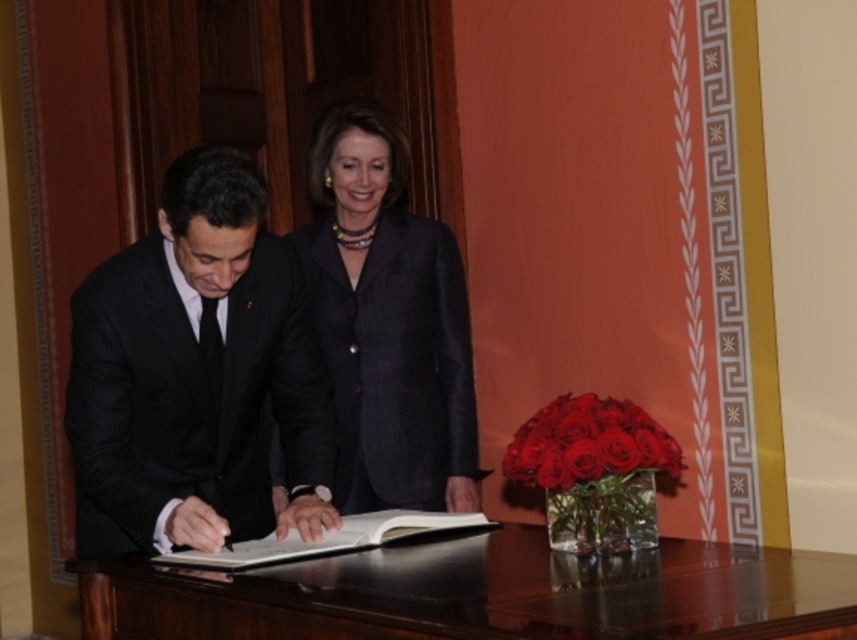
Question: Is black suit at center thinner than white paper at center?

Choices:
 (A) yes
 (B) no

Answer: (A)

Question: Which of these objects is positioned farthest from the matte black suit at center?

Choices:
 (A) shiny red roses at lower right
 (B) black suit at center
 (C) dark blue suit at center

Answer: (C)

Question: Which object is positioned closest to the shiny dark wood table at center?

Choices:
 (A) dark blue suit at center
 (B) white paper at center

Answer: (B)

Question: Among these objects, which one is farthest from the camera?

Choices:
 (A) dark blue suit at center
 (B) white paper at center

Answer: (A)

Question: Is shiny dark wood table at center positioned behind matte black suit at center?

Choices:
 (A) no
 (B) yes

Answer: (A)

Question: Observing the image, what is the correct spatial positioning of matte black suit at center in reference to shiny red roses at lower right?

Choices:
 (A) right
 (B) left

Answer: (B)